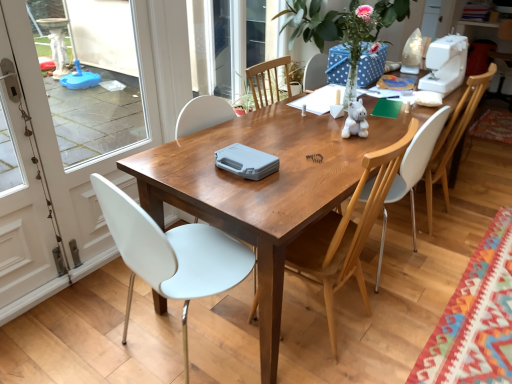
The height and width of the screenshot is (384, 512). What are the coordinates of `free space to the left of multicolored woven mat at lower right` in the screenshot? It's located at coord(373,300).